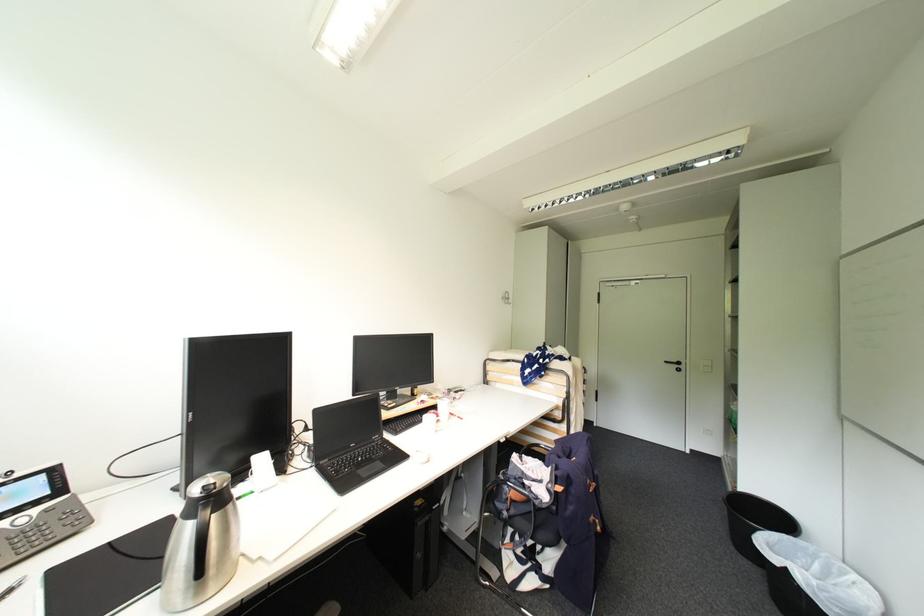
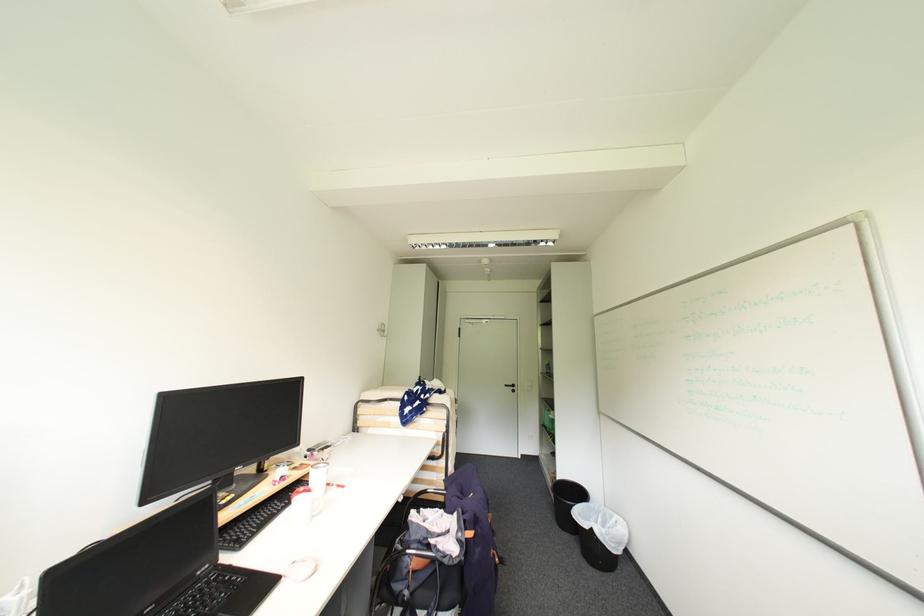
Where in the second image is the point corresponding to (424,453) from the first image?

(300, 564)